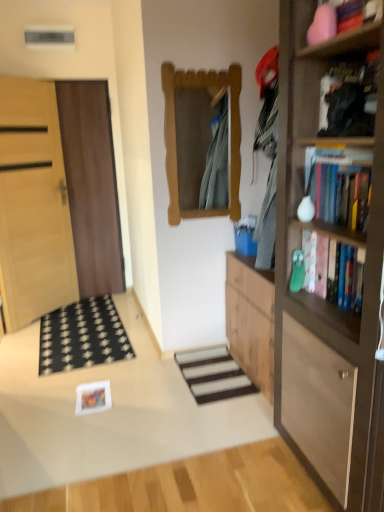
I want to click on free spot above wooden mirror at center (from a real-world perspective), so click(207, 56).